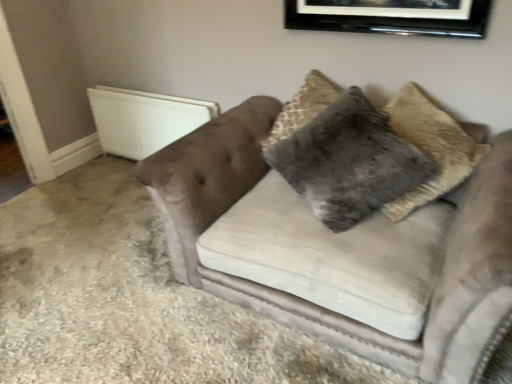
Question: Does black glossy picture frame at upper center have a greater width compared to fuzzy gray pillow at center?

Choices:
 (A) yes
 (B) no

Answer: (B)

Question: Is fuzzy gray pillow at center at the back of black glossy picture frame at upper center?

Choices:
 (A) yes
 (B) no

Answer: (B)

Question: From the image's perspective, is black glossy picture frame at upper center below fuzzy gray pillow at center?

Choices:
 (A) yes
 (B) no

Answer: (B)

Question: Would you say black glossy picture frame at upper center is outside fuzzy gray pillow at center?

Choices:
 (A) no
 (B) yes

Answer: (B)

Question: Does black glossy picture frame at upper center have a lesser height compared to fuzzy gray pillow at center?

Choices:
 (A) no
 (B) yes

Answer: (B)

Question: Does black glossy picture frame at upper center appear on the left side of fuzzy gray pillow at center?

Choices:
 (A) no
 (B) yes

Answer: (A)

Question: From the image's perspective, is white plastic radiator at left below fuzzy gray pillow at center?

Choices:
 (A) no
 (B) yes

Answer: (A)

Question: Can you confirm if white plastic radiator at left is wider than fuzzy gray pillow at center?

Choices:
 (A) yes
 (B) no

Answer: (B)

Question: Does white plastic radiator at left come behind fuzzy gray pillow at center?

Choices:
 (A) yes
 (B) no

Answer: (A)

Question: Is white plastic radiator at left next to fuzzy gray pillow at center and touching it?

Choices:
 (A) yes
 (B) no

Answer: (B)

Question: Is white plastic radiator at left completely or partially outside of fuzzy gray pillow at center?

Choices:
 (A) yes
 (B) no

Answer: (A)

Question: Does white plastic radiator at left have a smaller size compared to fuzzy gray pillow at center?

Choices:
 (A) yes
 (B) no

Answer: (A)

Question: From a real-world perspective, is velvet couch at center on fuzzy gray pillow at center?

Choices:
 (A) yes
 (B) no

Answer: (B)